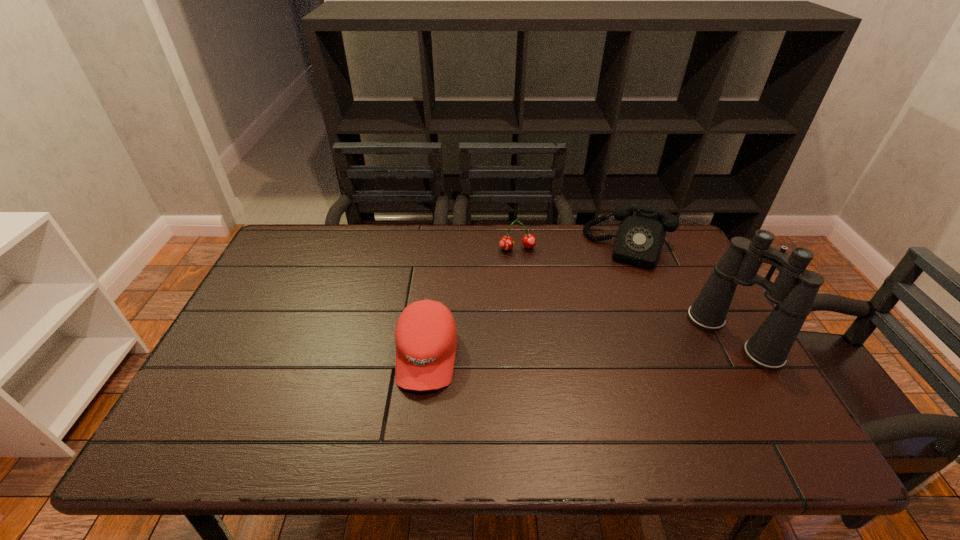
The height and width of the screenshot is (540, 960). In the image, there is a desktop. In order to click on vacant region at the right edge in this screenshot , I will do `click(701, 275)`.

At what (x,y) coordinates should I click in order to perform the action: click on free location at the near left corner of the desktop. Please return your answer as a coordinate pair (x, y). Looking at the image, I should click on (242, 411).

Locate an element on the screen. Image resolution: width=960 pixels, height=540 pixels. vacant region between the leftmost object and the telephone is located at coordinates (528, 302).

At what (x,y) coordinates should I click in order to perform the action: click on unoccupied area between the binoculars and the third object from right to left. Please return your answer as a coordinate pair (x, y). Looking at the image, I should click on (625, 293).

At what (x,y) coordinates should I click in order to perform the action: click on vacant point located between the cap and the tallest object. Please return your answer as a coordinate pair (x, y). This screenshot has height=540, width=960. Looking at the image, I should click on (580, 346).

The height and width of the screenshot is (540, 960). Identify the location of blank region between the binoculars and the cap. (580, 346).

Find the location of a particular element. The height and width of the screenshot is (540, 960). vacant area that lies between the second object from left to right and the binoculars is located at coordinates (625, 293).

Image resolution: width=960 pixels, height=540 pixels. Identify the location of free space that is in between the binoculars and the cherry. (625, 293).

Identify the location of free space between the telephone and the leftmost object. (528, 302).

Locate an element on the screen. The image size is (960, 540). blank region between the third object from right to left and the telephone is located at coordinates (574, 248).